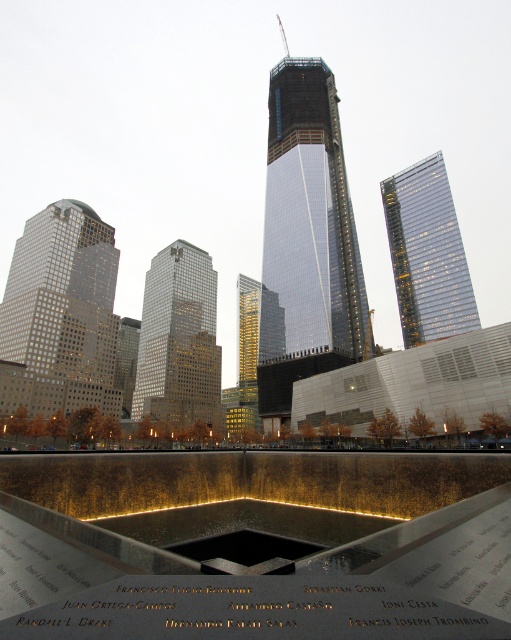
You are an architect observing the urban landscape. You need to determine the spatial relationship between the reflective metallic water at center and the glassy steel skyscraper at center. Which object is positioned higher in the scene?

The glassy steel skyscraper at center is positioned higher than the reflective metallic water at center since the water is located below it.

You are an architect reviewing a cityscape design. You notice a point labeled at coordinates (254,545). Based on the scene description, what does this point most likely represent?

The point at coordinates (254,545) marks the location of reflective metallic water at center.

You are a drone operator planning to fly a drone from the reflective metallic water at center to the glassy steel skyscraper at center. Based on the scene, will the drone need to ascend or descend to reach the skyscraper from the water?

The reflective metallic water at center has a lesser height compared to glassy steel skyscraper at center, so the drone will need to ascend to reach the skyscraper from the water.